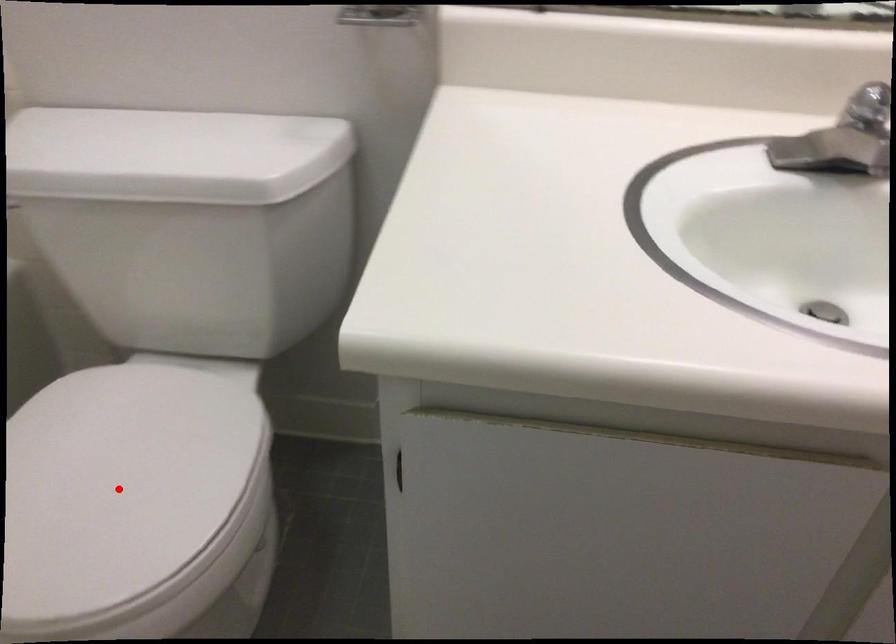
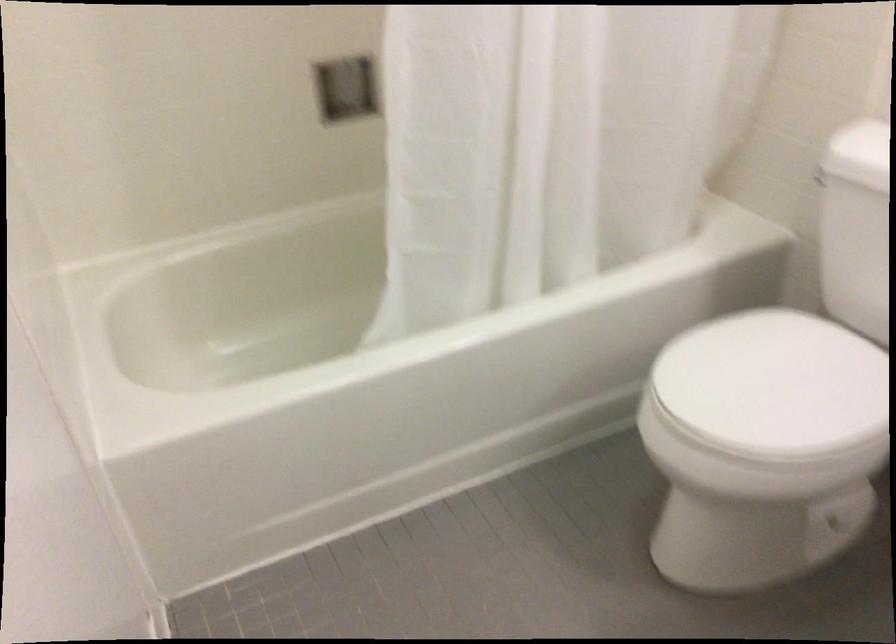
Question: I am providing you with two images of the same scene from different viewpoints. Image1 has a red point marked. In image2, the corresponding 3D location appears at what relative position? Reply with the corresponding letter.

Choices:
 (A) Closer
 (B) Farther

Answer: (B)